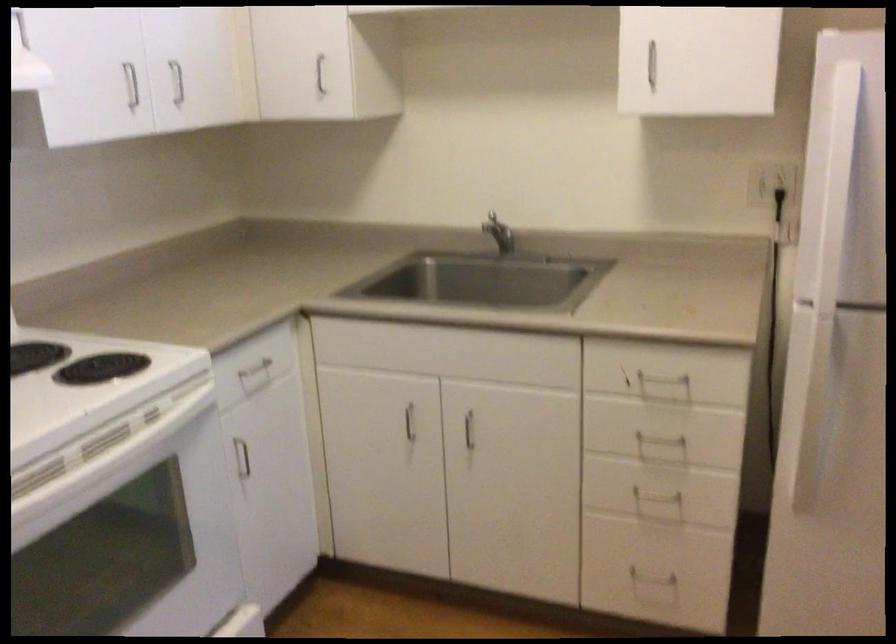
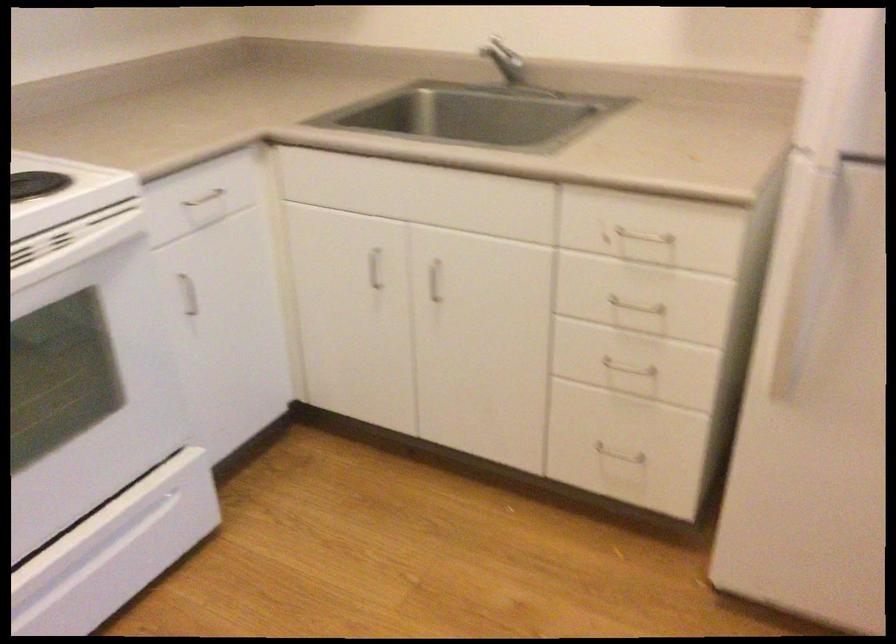
Question: I am providing you with two images of the same scene from different viewpoints. Please identify which objects are invisible in image2.

Choices:
 (A) white oven handle
 (B) metal pull handle
 (C) silver faucet handle
 (D) none of these

Answer: (D)